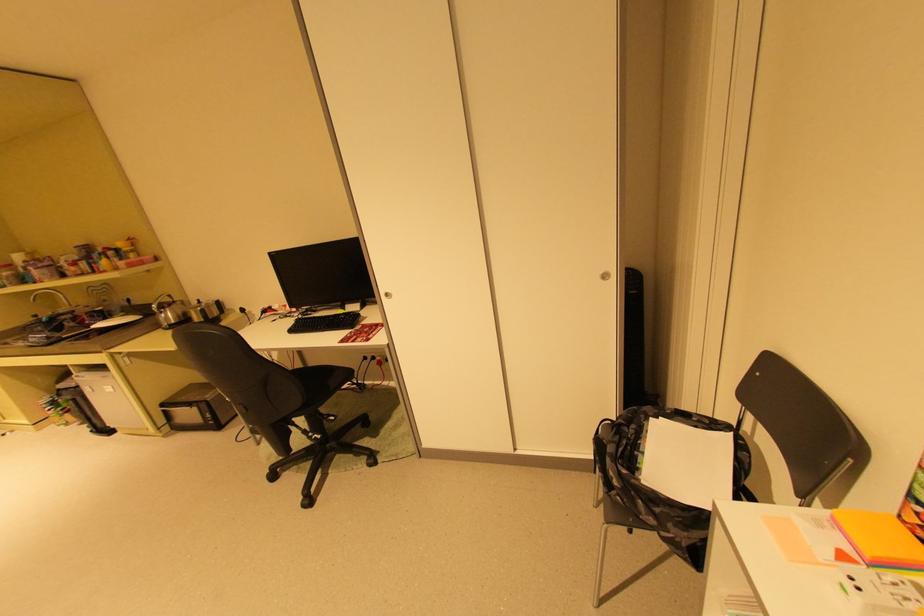
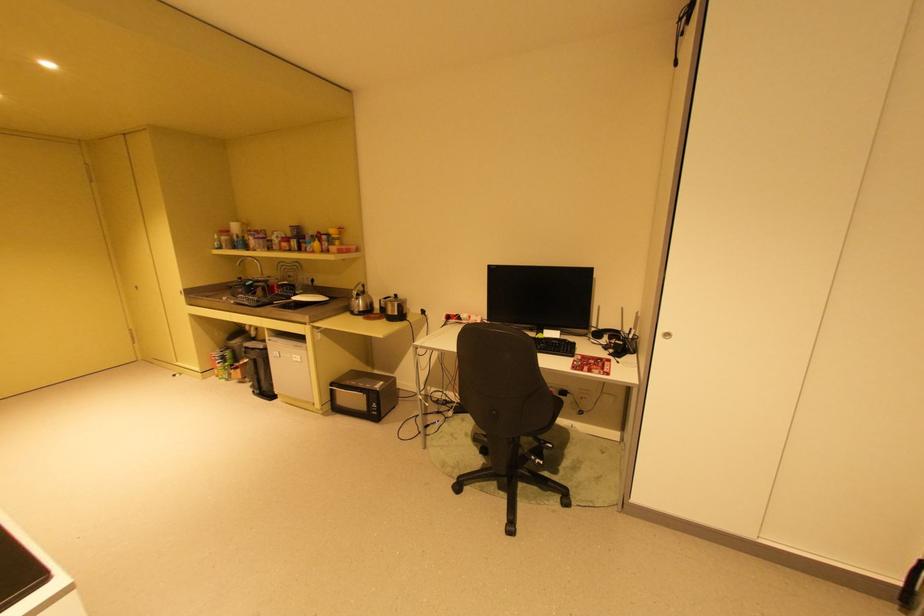
Question: What movement of the cameraman would produce the second image?

Choices:
 (A) Left
 (B) Right
 (C) Forward
 (D) Backward

Answer: (A)